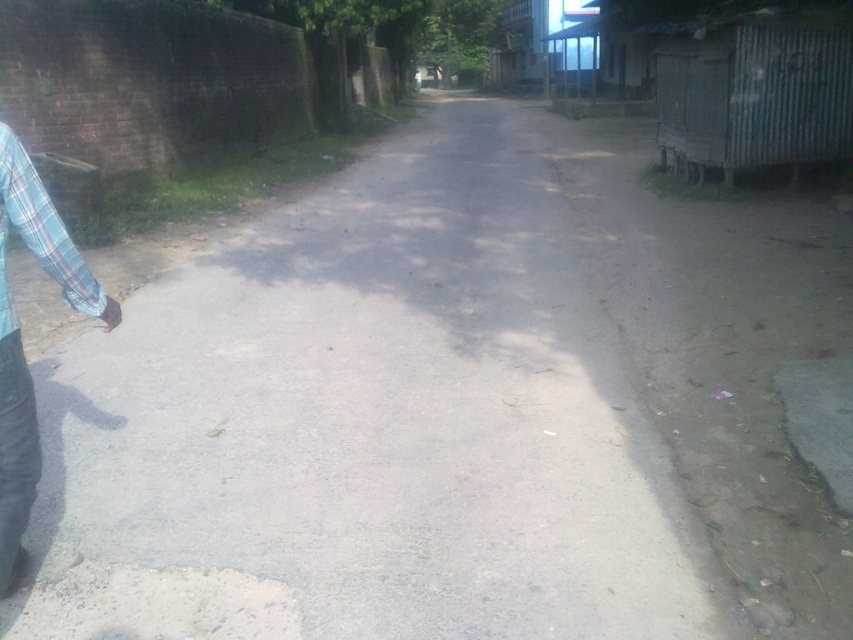
You are driving a delivery van that is 4 meters long. You need to pass through the narrow road shown in the image. The gray concrete pavement at center is the only path available. Can your van fit through the narrow road without any issues?

The gray concrete pavement at center is 4.18 meters in width, which is slightly wider than the van. The van can fit through the narrow road as long as it stays centered on the gray concrete pavement at center.

You are standing on the narrow road and see two shirts hanging on the left side wall. Which shirt is closer to you, the blue plaid shirt at left or the plaid fabric shirt at left?

The blue plaid shirt at left is closer to you as it is in front of the plaid fabric shirt at left.